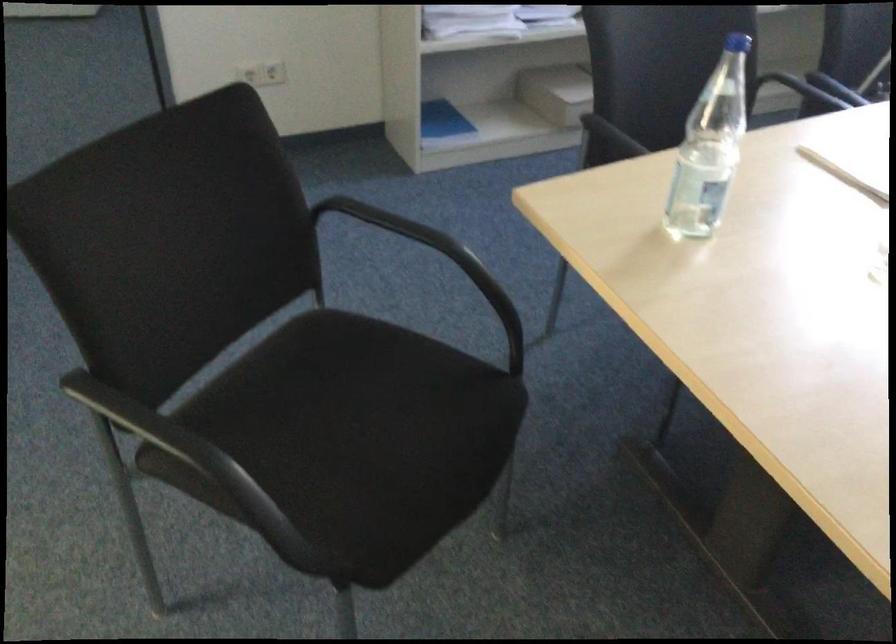
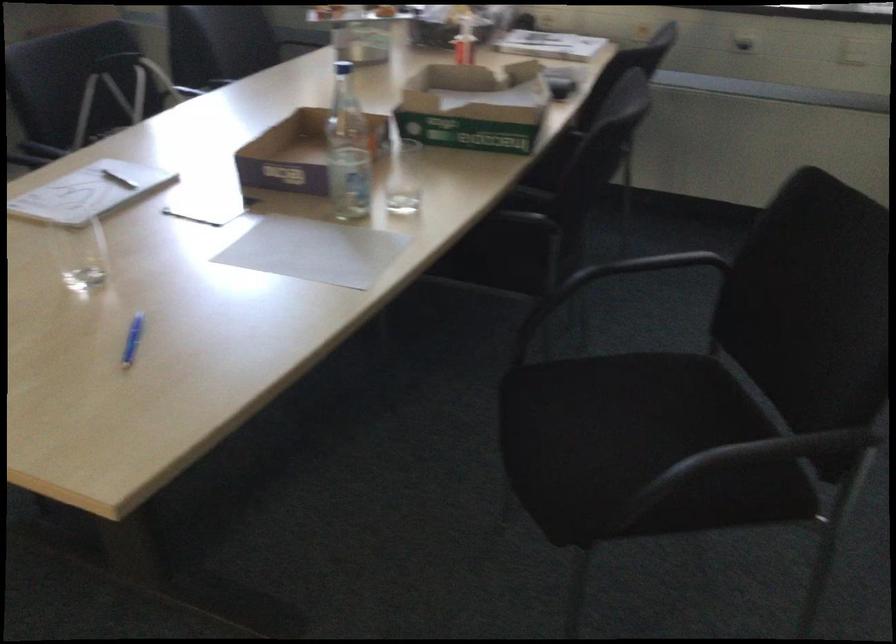
Question: The camera is either moving clockwise (left) or counter-clockwise (right) around the object. The first image is from the beginning of the video and the second image is from the end. Is the camera moving left or right when shooting the video?

Choices:
 (A) Left
 (B) Right

Answer: (A)